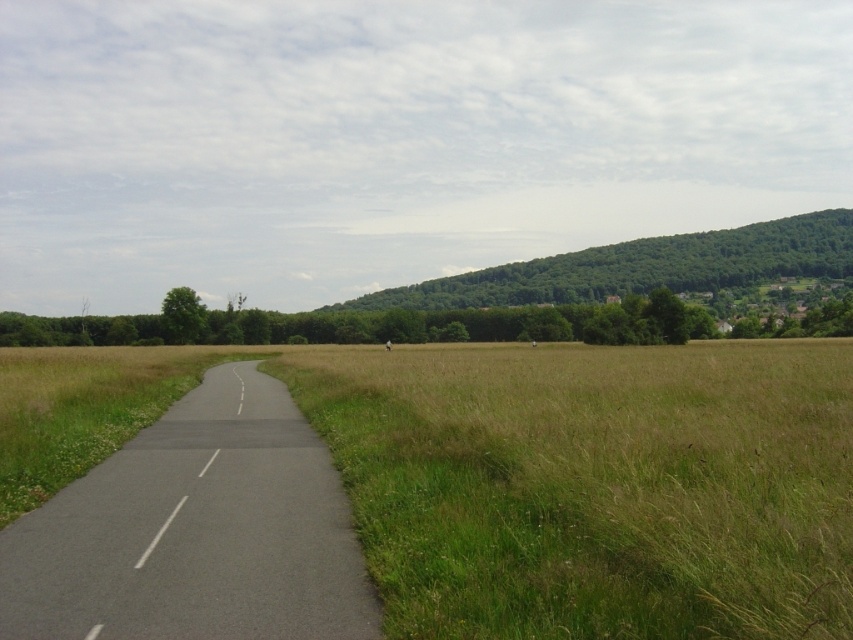
You are standing at the edge of the road and see the green grass at center and the green leafy hill at upper right. Which object is positioned to the left of the other?

The green grass at center is positioned to the left of the green leafy hill at upper right.